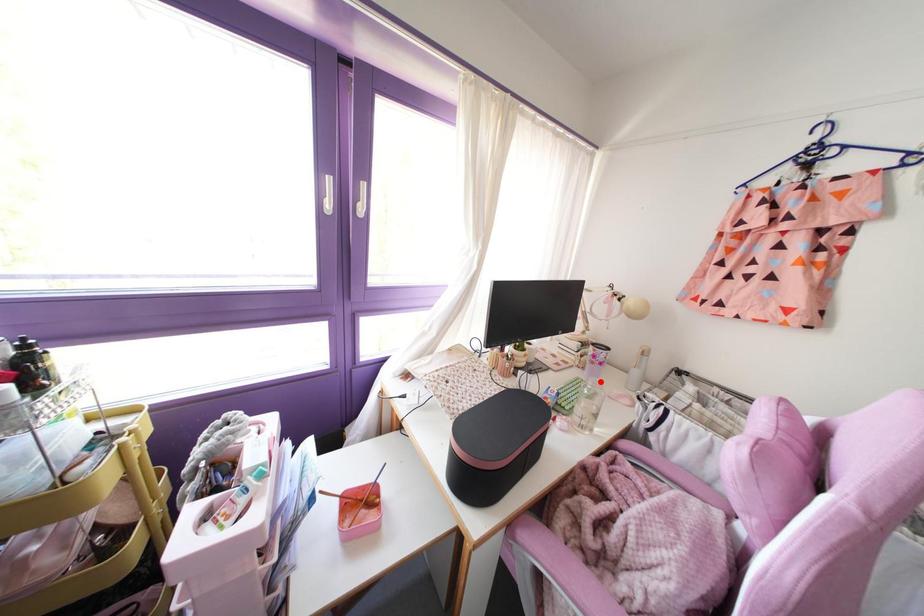
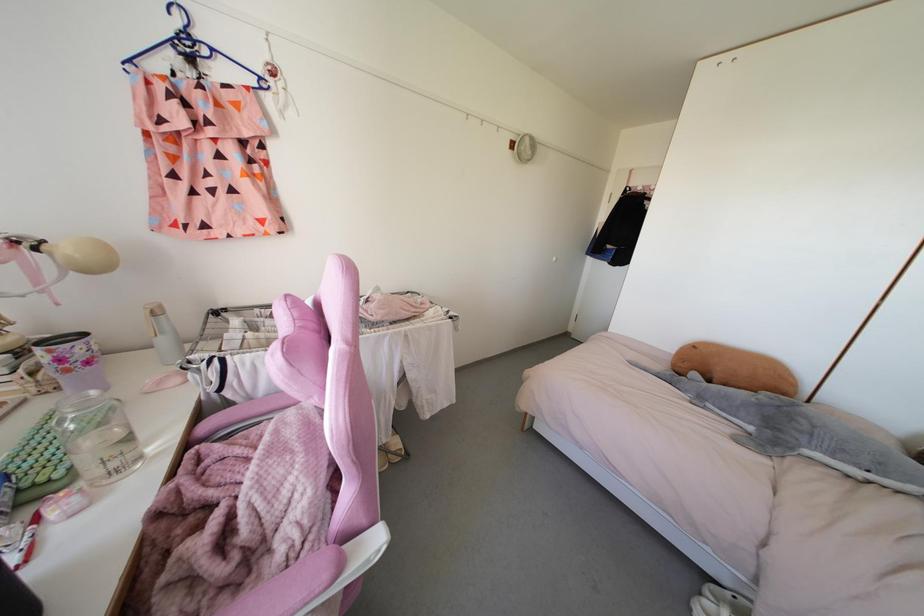
In the second image, find the point that corresponds to the highlighted location in the first image.

(92, 392)